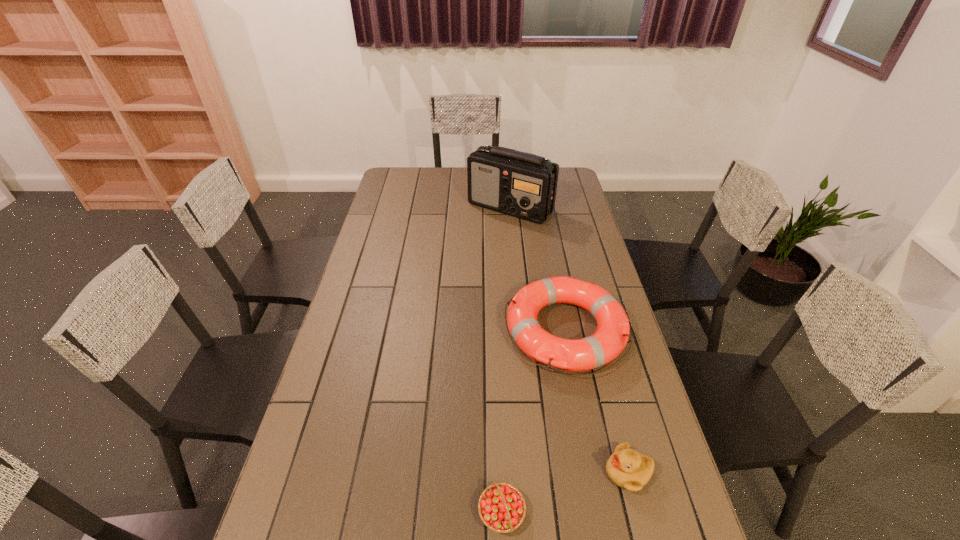
At what (x,y) coordinates should I click in order to perform the action: click on radio receiver. Please return your answer as a coordinate pair (x, y). The image size is (960, 540). Looking at the image, I should click on (523, 185).

Identify the location of the farthest object. Image resolution: width=960 pixels, height=540 pixels. (523, 185).

I want to click on life buoy, so click(x=611, y=336).

Locate an element on the screen. The width and height of the screenshot is (960, 540). duckling is located at coordinates (628, 469).

Image resolution: width=960 pixels, height=540 pixels. What are the coordinates of `strawberry` in the screenshot? It's located at (502, 508).

Identify the location of vacant position located on the front panel of the farthest object. The height and width of the screenshot is (540, 960). (514, 239).

What are the coordinates of `vacant region located 0.290m on the back of the life buoy` in the screenshot? It's located at (547, 239).

The width and height of the screenshot is (960, 540). In order to click on vacant space located at the beak of the duckling in this screenshot , I will do `click(580, 472)`.

Identify the location of free location located at the beak of the duckling. This screenshot has height=540, width=960. (521, 472).

Where is `free region located at the beak of the duckling`? The width and height of the screenshot is (960, 540). free region located at the beak of the duckling is located at coordinates (538, 472).